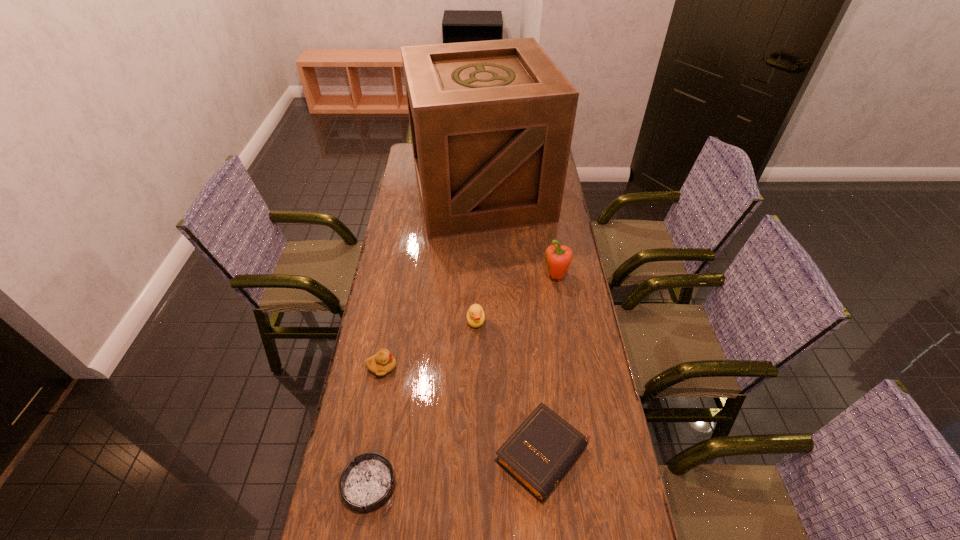
Where is `vacant position in the image that satisfies the following two spatial constraints: 1. on the back side of the ashtray; 2. at the beak of the nearer duckling`? The image size is (960, 540). vacant position in the image that satisfies the following two spatial constraints: 1. on the back side of the ashtray; 2. at the beak of the nearer duckling is located at coordinates (389, 367).